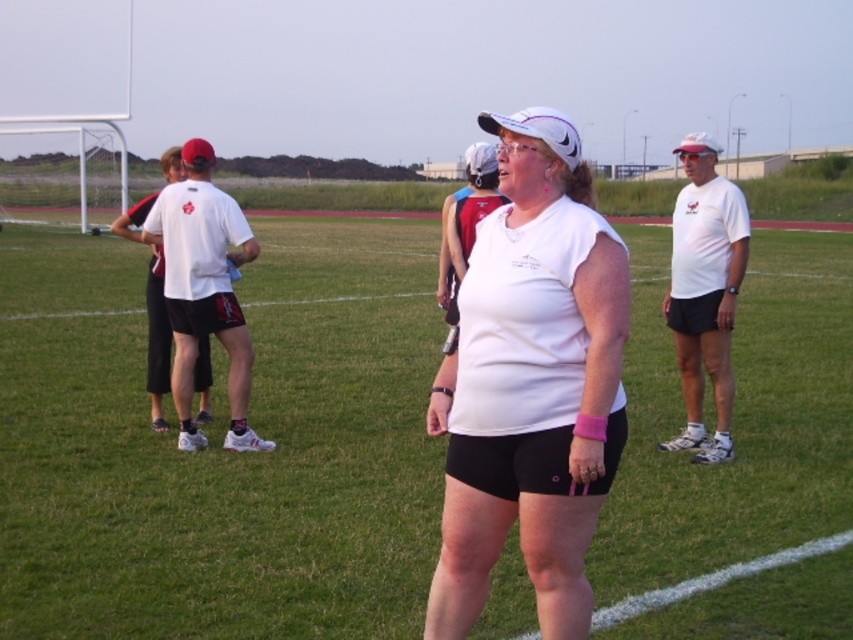
Question: Can you confirm if green grass at center is positioned to the right of white matte t-shirt at center?

Choices:
 (A) no
 (B) yes

Answer: (A)

Question: Is green grass at center smaller than white matte t-shirt at center?

Choices:
 (A) yes
 (B) no

Answer: (B)

Question: Is green grass at center further to the viewer compared to white matte t-shirt at center?

Choices:
 (A) no
 (B) yes

Answer: (B)

Question: Which point is farther from the camera taking this photo?

Choices:
 (A) (152, 445)
 (B) (575, 312)

Answer: (A)